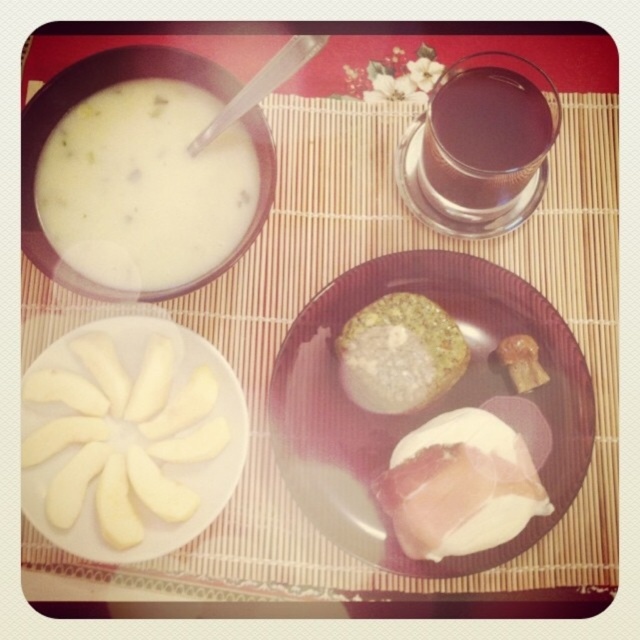
Question: Does dark glass beverage at upper right have a larger size compared to golden crispy pastry at center?

Choices:
 (A) yes
 (B) no

Answer: (A)

Question: Does white creamy cheese at center have a lesser width compared to dark glass beverage at upper right?

Choices:
 (A) yes
 (B) no

Answer: (B)

Question: Which of these objects is positioned farthest from the golden crispy pastry at center?

Choices:
 (A) white glossy plate at center
 (B) white creamy soup at upper left
 (C) white creamy cheese at center
 (D) slightly translucent brown cookie at center

Answer: (B)

Question: Estimate the real-world distances between objects in this image. Which object is farther from the golden crispy pastry at center?

Choices:
 (A) white smooth apple slices at center left
 (B) white glossy plate at center
 (C) white creamy soup at upper left
 (D) white creamy cheese at center

Answer: (C)

Question: Is white glossy plate at center positioned before dark glass beverage at upper right?

Choices:
 (A) yes
 (B) no

Answer: (B)

Question: Which object is positioned farthest from the white creamy cheese at center?

Choices:
 (A) golden crispy pastry at center
 (B) white smooth apple slices at center left
 (C) slightly translucent brown cookie at center
 (D) white creamy soup at upper left

Answer: (D)